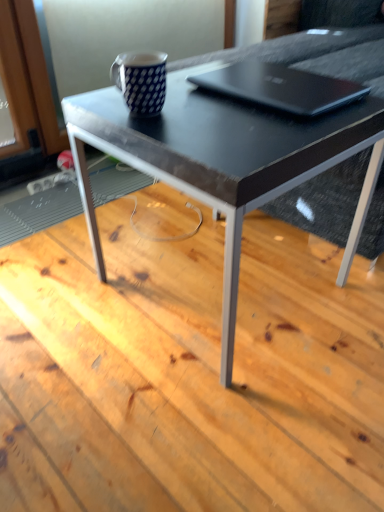
This screenshot has width=384, height=512. I want to click on free space underneath black matte laptop at upper center (from a real-world perspective), so click(x=298, y=93).